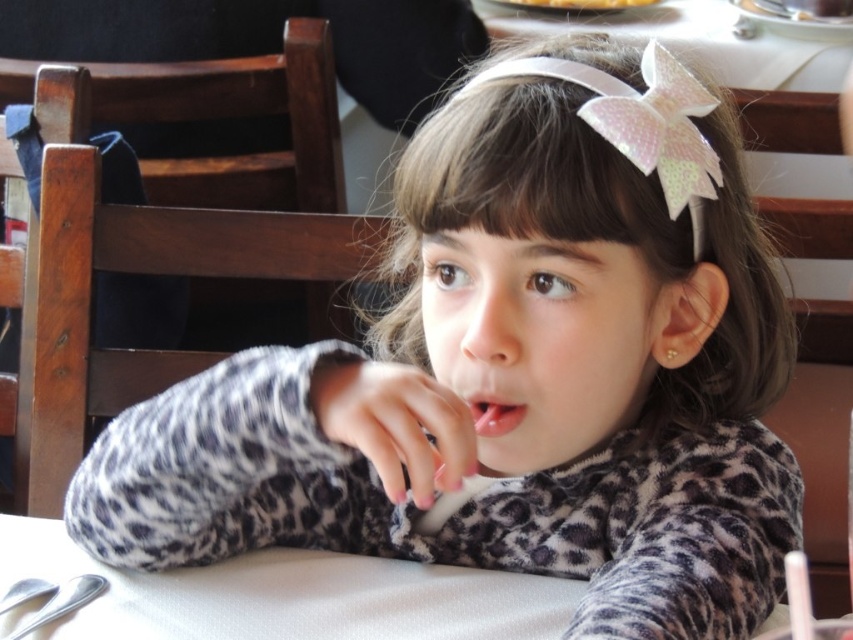
Question: Among these points, which one is farthest from the camera?

Choices:
 (A) (213, 616)
 (B) (480, 401)

Answer: (A)

Question: Is white matte table at center behind pink glossy lips at center?

Choices:
 (A) no
 (B) yes

Answer: (B)

Question: Which of the following is the closest to the observer?

Choices:
 (A) white matte table at center
 (B) pink glossy lips at center

Answer: (B)

Question: Among these points, which one is farthest from the camera?

Choices:
 (A) (141, 621)
 (B) (490, 403)

Answer: (A)

Question: Is white matte table at center to the left of pink glossy lips at center from the viewer's perspective?

Choices:
 (A) no
 (B) yes

Answer: (B)

Question: From the image, what is the correct spatial relationship of white matte table at center in relation to pink glossy lips at center?

Choices:
 (A) below
 (B) above

Answer: (A)